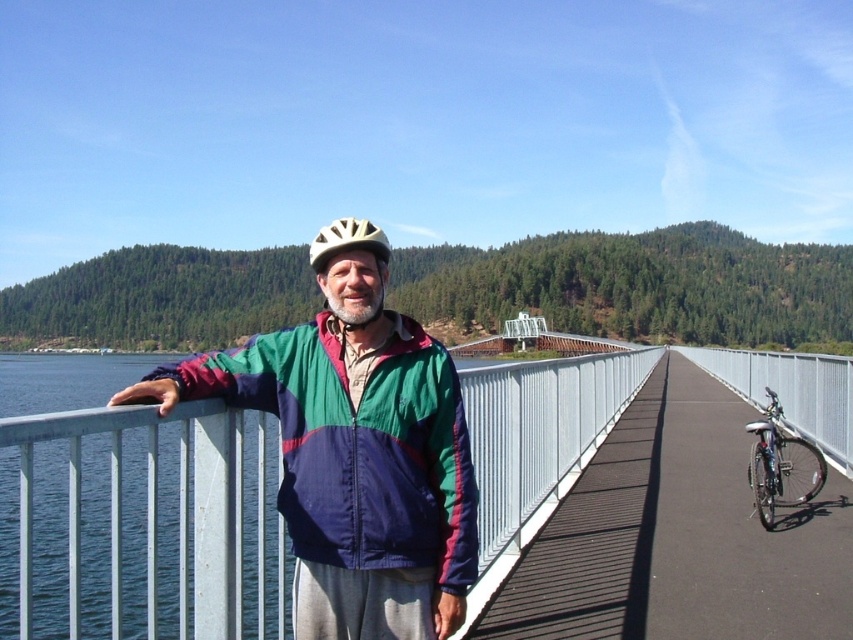
Looking at this image, you are a photographer planning to take a photo of the multicolored fabric jacket at center and the silver metallic bicycle at right. Considering their sizes, which object should you focus on first to ensure both fit in the frame?

The multicolored fabric jacket at center has a lesser width compared to the silver metallic bicycle at right, so you should focus on the silver metallic bicycle at right first to ensure both fit in the frame since it is wider and requires more space.

You are a pedestrian trying to cross the bridge and need to pass the silver metallic bicycle at right. According to the scene, where is the matte yellow helmet at center located relative to the bicycle?

The matte yellow helmet at center is behind the silver metallic bicycle at right.

You are standing on the bridge and see a point marked at coordinates (358, 445). Based on the scene description, where is this point located?

The point at coordinates (358, 445) is located on the multicolored fabric jacket at center.